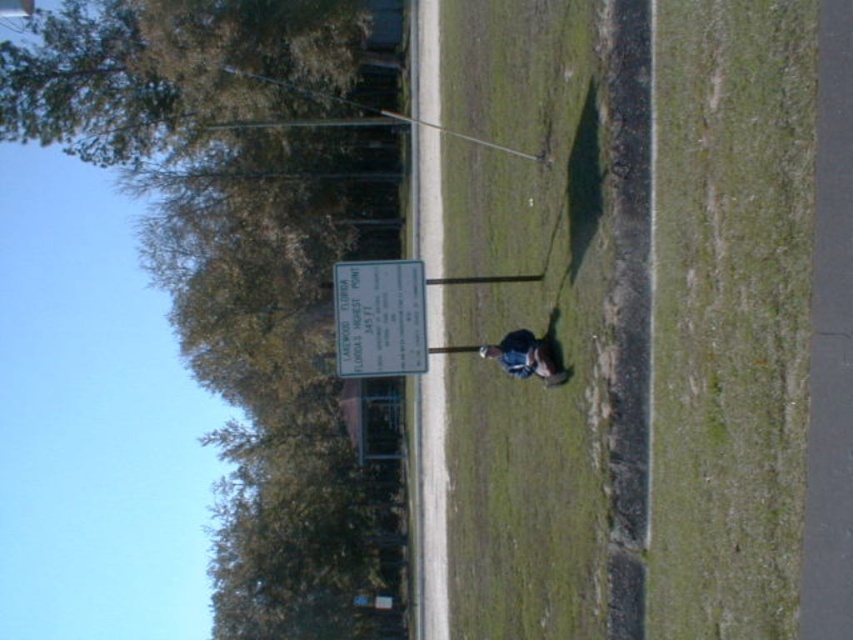
Can you confirm if green leafy tree at upper left is wider than green grass at center?

Correct, the width of green leafy tree at upper left exceeds that of green grass at center.

Between green leafy tree at upper left and green grass at center, which one is positioned higher?

green leafy tree at upper left is above.

Which is behind, point (181, 177) or point (486, 24)?

Point (181, 177)

This screenshot has height=640, width=853. Find the location of `green leafy tree at upper left`. green leafy tree at upper left is located at coordinates (247, 262).

Does green leafy tree at upper left have a larger size compared to dark blue denim jacket at center?

Indeed, green leafy tree at upper left has a larger size compared to dark blue denim jacket at center.

Which is behind, point (254, 250) or point (514, 332)?

The point (254, 250) is behind.

In order to click on green leafy tree at upper left in this screenshot , I will do `click(247, 262)`.

The image size is (853, 640). What do you see at coordinates (379, 317) in the screenshot?
I see `white plastic sign at center` at bounding box center [379, 317].

Does point (376, 294) come in front of point (550, 348)?

No.

Measure the distance between white plastic sign at center and camera.

white plastic sign at center is 16.59 meters from camera.

You are a GUI agent. You are given a task and a screenshot of the screen. Output one action in this format:
    pyautogui.click(x=<x>, y=<y>)
    Task: Click on the white plastic sign at center
    
    Given the screenshot: What is the action you would take?
    pyautogui.click(x=379, y=317)